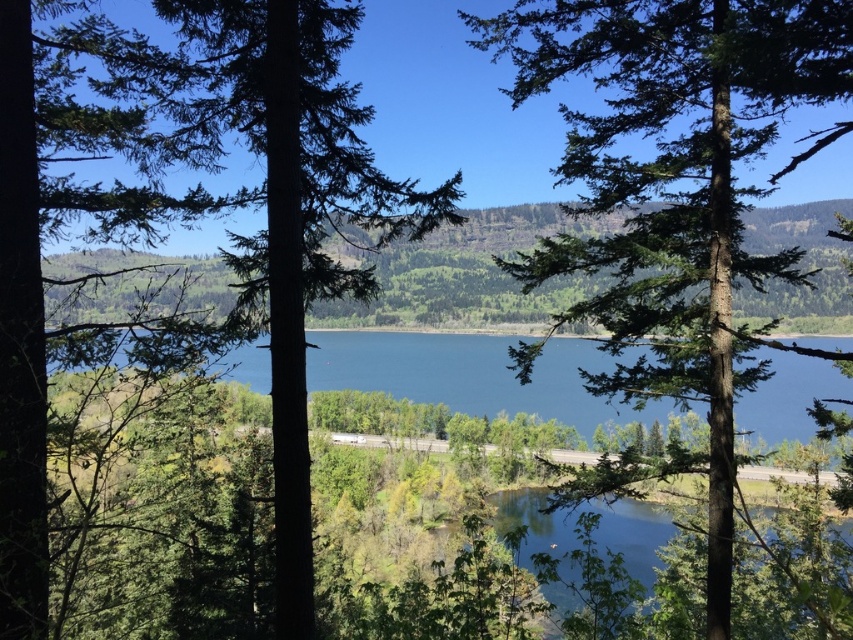
You are standing in the valley and see two points marked in the image. Which point is closer to you, point (x=630, y=209) or point (x=436, y=531)?

Point (x=630, y=209) is further to the viewer than point (x=436, y=531), so point (x=436, y=531) is closer to you.

You are standing in a forest clearing and see a point marked at coordinates [676,189]. What object is located at this point?

The point at [676,189] indicates a green textured tree at center.

You are standing in a forest and see the green matte tree at center and the blue glassy water at center. Which object is nearer to you?

The green matte tree at center is closer to the viewer than the blue glassy water at center.